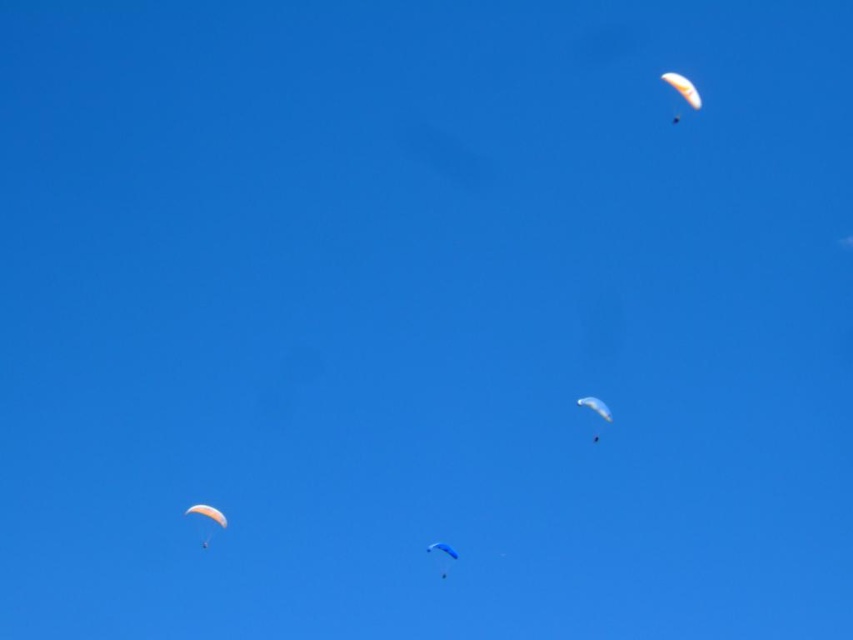
Question: Can you confirm if white matte parachute at center is bigger than blue fabric parachute at center?

Choices:
 (A) no
 (B) yes

Answer: (B)

Question: Which object is the closest to the white matte parachute at lower left?

Choices:
 (A) white matte parachute at center
 (B) blue fabric parachute at center
 (C) orange translucent parasail at upper right

Answer: (B)

Question: Which object is the closest to the white matte parachute at lower left?

Choices:
 (A) blue fabric parachute at center
 (B) orange translucent parasail at upper right

Answer: (A)

Question: Which is nearer to the blue fabric parachute at center?

Choices:
 (A) orange translucent parasail at upper right
 (B) white matte parachute at center

Answer: (B)

Question: Is orange translucent parasail at upper right above white matte parachute at center?

Choices:
 (A) no
 (B) yes

Answer: (B)

Question: Is white matte parachute at center positioned behind blue fabric parachute at center?

Choices:
 (A) yes
 (B) no

Answer: (B)